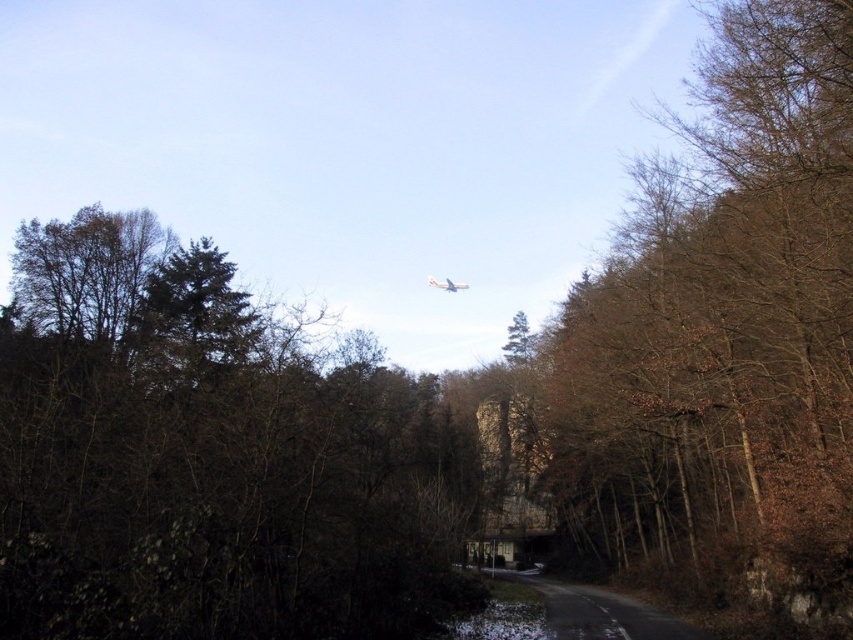
Does brown leafy tree at center appear under white glossy airplane at center?

Correct, brown leafy tree at center is located below white glossy airplane at center.

Is brown leafy tree at center shorter than white glossy airplane at center?

No.

Is point (730, 102) farther from camera compared to point (444, 288)?

No, (730, 102) is closer to viewer.

Identify the location of brown leafy tree at center. The image size is (853, 640). (726, 333).

Looking at this image, which is more to the right, brown leafy tree at upper center or white glossy airplane at center?

white glossy airplane at center

Describe the element at coordinates (207, 458) in the screenshot. This screenshot has width=853, height=640. I see `brown leafy tree at upper center` at that location.

At what (x,y) coordinates should I click in order to perform the action: click on brown leafy tree at upper center. Please return your answer as a coordinate pair (x, y). The width and height of the screenshot is (853, 640). Looking at the image, I should click on (207, 458).

Can you confirm if brown leafy tree at upper center is positioned to the left of brown leafy tree at center?

Indeed, brown leafy tree at upper center is positioned on the left side of brown leafy tree at center.

Which is more to the right, brown leafy tree at upper center or brown leafy tree at center?

brown leafy tree at center is more to the right.

You are a GUI agent. You are given a task and a screenshot of the screen. Output one action in this format:
    pyautogui.click(x=<x>, y=<y>)
    Task: Click on the brown leafy tree at upper center
    
    Given the screenshot: What is the action you would take?
    pyautogui.click(x=207, y=458)